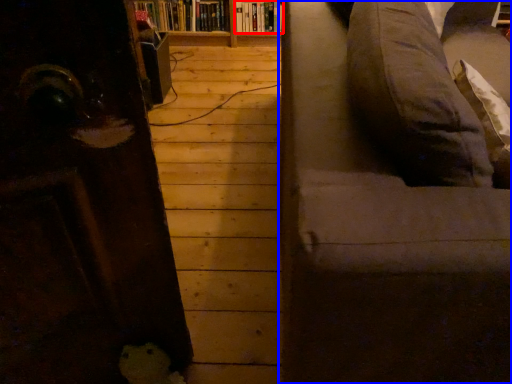
Question: Which object is closer to the camera taking this photo, book (highlighted by a red box) or studio couch (highlighted by a blue box)?

Choices:
 (A) book
 (B) studio couch

Answer: (B)